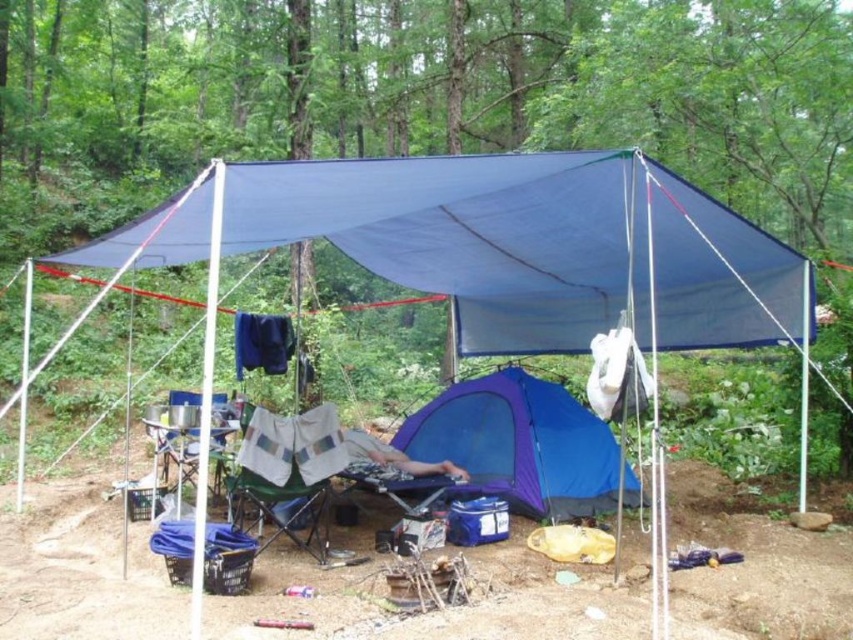
You are setting up a campsite and need to choose between the blue fabric tent at center and the blue nylon tent at center. Which one offers more space for your gear?

The blue fabric tent at center has a larger size compared to the blue nylon tent at center, so it offers more space for your gear.

You are setting up a campsite and need to place a new item. According to the image, where exactly is the blue fabric tent at center located in terms of coordinates?

The blue fabric tent at center is located at coordinates point (494,248).